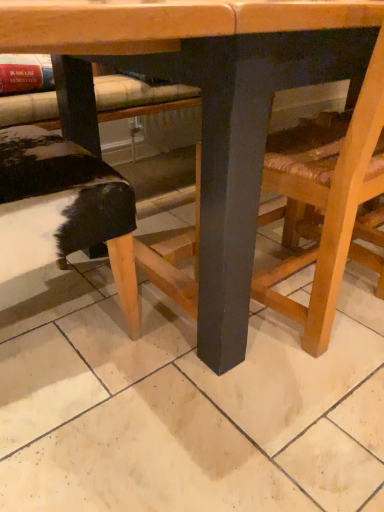
Question: Should I look upward or downward to see black furry cushion at lower left?

Choices:
 (A) up
 (B) down

Answer: (A)

Question: From a real-world perspective, is black furry cushion at lower left positioned under wooden table at center based on gravity?

Choices:
 (A) no
 (B) yes

Answer: (B)

Question: Considering the relative sizes of black furry cushion at lower left and wooden table at center in the image provided, is black furry cushion at lower left taller than wooden table at center?

Choices:
 (A) no
 (B) yes

Answer: (A)

Question: Can you confirm if black furry cushion at lower left is wider than wooden table at center?

Choices:
 (A) yes
 (B) no

Answer: (B)

Question: From the image's perspective, does black furry cushion at lower left appear lower than wooden table at center?

Choices:
 (A) no
 (B) yes

Answer: (B)

Question: Can you confirm if black furry cushion at lower left is smaller than wooden table at center?

Choices:
 (A) no
 (B) yes

Answer: (B)

Question: Does black furry cushion at lower left have a larger size compared to wooden table at center?

Choices:
 (A) no
 (B) yes

Answer: (A)

Question: Does black furry cushion at lower left lie behind wooden chair at lower right?

Choices:
 (A) no
 (B) yes

Answer: (B)

Question: Is black furry cushion at lower left far from wooden chair at lower right?

Choices:
 (A) no
 (B) yes

Answer: (A)

Question: Are black furry cushion at lower left and wooden chair at lower right making contact?

Choices:
 (A) yes
 (B) no

Answer: (B)

Question: Would you say black furry cushion at lower left contains wooden chair at lower right?

Choices:
 (A) no
 (B) yes

Answer: (A)

Question: Is black furry cushion at lower left oriented towards wooden chair at lower right?

Choices:
 (A) no
 (B) yes

Answer: (B)

Question: Considering the relative positions of black furry cushion at lower left and wooden chair at lower right in the image provided, is black furry cushion at lower left to the left of wooden chair at lower right from the viewer's perspective?

Choices:
 (A) yes
 (B) no

Answer: (A)

Question: Is black furry cushion at lower left surrounded by wooden chair at lower right?

Choices:
 (A) yes
 (B) no

Answer: (B)